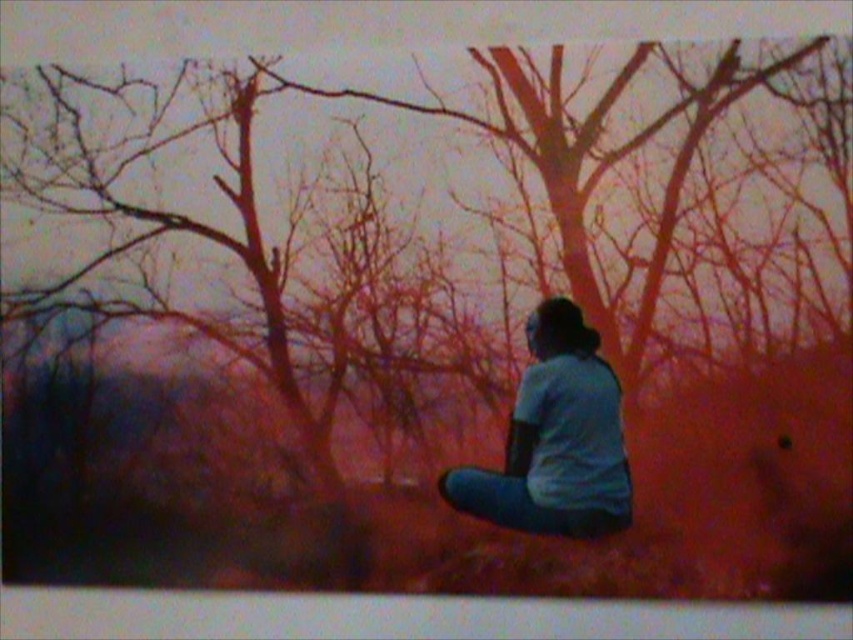
You are standing in the outdoor scene and want to take a photo of the light blue fabric shirt at center and the smooth bark tree at center. Which object should you adjust your camera to focus on first if you want both to be in the frame?

The smooth bark tree at center is positioned on the left side of light blue fabric shirt at center, so you should focus on the smooth bark tree at center first to ensure both are in the frame.

You are an artist trying to paint this scene. You want to ensure the smooth bark tree at center and the light blue fabric shirt at center are proportionally accurate. Which object should you draw first to maintain the correct size relationship between them?

You should draw the smooth bark tree at center first because it is larger in size than the light blue fabric shirt at center, allowing you to establish the scale before adding smaller details.